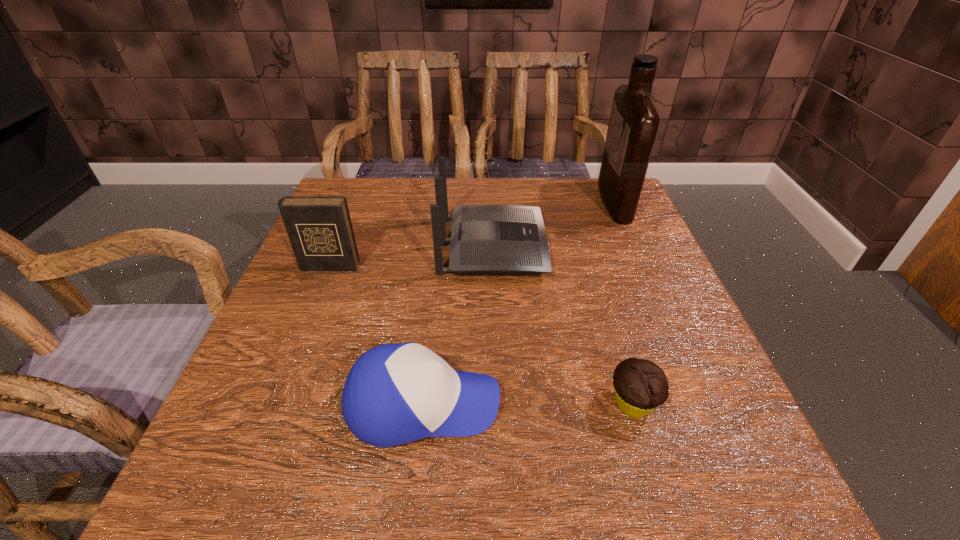
This screenshot has height=540, width=960. Identify the location of the rightmost object. (633, 125).

Locate an element on the screen. The height and width of the screenshot is (540, 960). the tallest object is located at coordinates (633, 125).

Identify the location of router. The height and width of the screenshot is (540, 960). (485, 239).

Locate an element on the screen. This screenshot has width=960, height=540. the leftmost object is located at coordinates (319, 228).

The width and height of the screenshot is (960, 540). In order to click on the fourth tallest object in this screenshot , I will do `click(394, 394)`.

Locate an element on the screen. The height and width of the screenshot is (540, 960). the shortest object is located at coordinates (640, 386).

What are the coordinates of `muffin` in the screenshot? It's located at (640, 386).

The image size is (960, 540). What are the coordinates of `free space located 0.060m on the label side of the liquor` in the screenshot? It's located at 578,201.

The width and height of the screenshot is (960, 540). In order to click on free space located on the label side of the liquor in this screenshot , I will do `click(563, 201)`.

At what (x,y) coordinates should I click in order to perform the action: click on free spot located 0.200m on the label side of the liquor. Please return your answer as a coordinate pair (x, y). The width and height of the screenshot is (960, 540). Looking at the image, I should click on (523, 201).